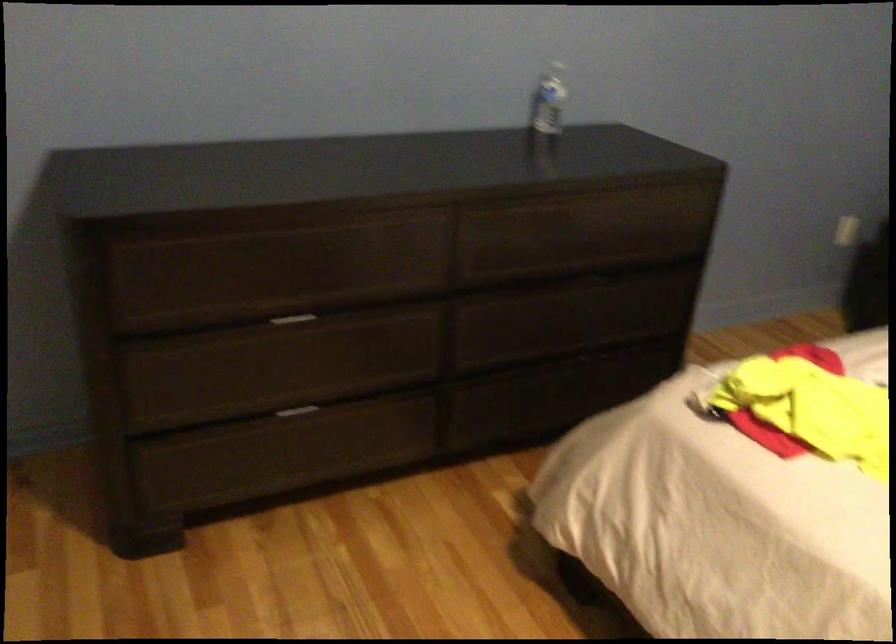
The height and width of the screenshot is (644, 896). What are the coordinates of `white wall switch` in the screenshot? It's located at (848, 231).